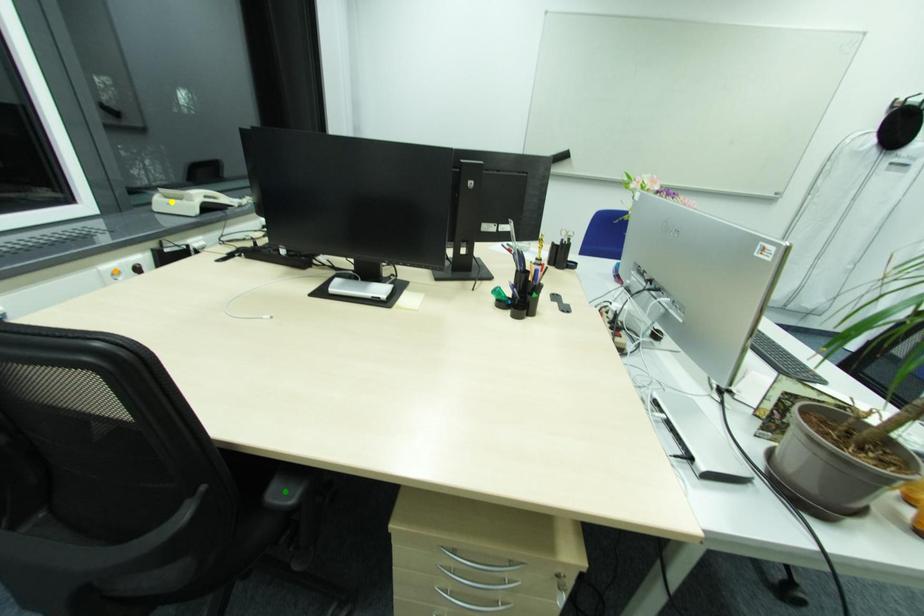
Order these from nearest to farthest:
yellow point, orange point, green point

green point
orange point
yellow point